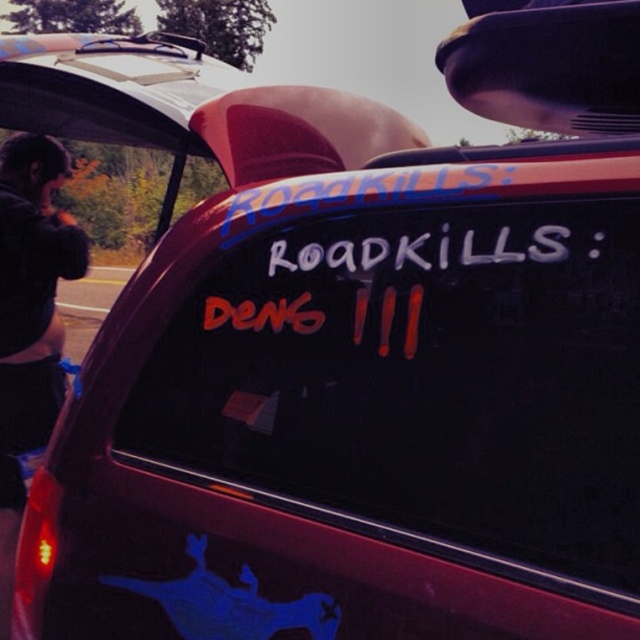
You are driving a car and need to park between the white paint road sign at center and the black fabric jacket at left. Can your car fit between them if the car is 2 meters wide?

The white paint road sign at center is wider than the black fabric jacket at left. Therefore, the space between them may not be sufficient for a 2 meter wide car to fit comfortably. Check the exact measurements before parking.